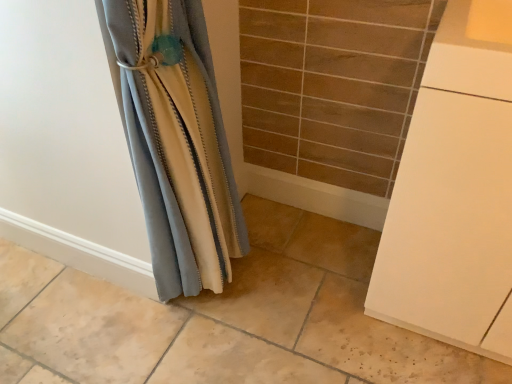
Question: Is white matte cabinet at right wider or thinner than satin fabric curtain at left?

Choices:
 (A) thin
 (B) wide

Answer: (B)

Question: Considering the positions of white matte cabinet at right and satin fabric curtain at left in the image, is white matte cabinet at right bigger or smaller than satin fabric curtain at left?

Choices:
 (A) big
 (B) small

Answer: (A)

Question: Which is correct: white matte cabinet at right is inside satin fabric curtain at left, or outside of it?

Choices:
 (A) inside
 (B) outside

Answer: (B)

Question: Relative to white matte cabinet at right, is satin fabric curtain at left in front or behind?

Choices:
 (A) front
 (B) behind

Answer: (B)

Question: Is satin fabric curtain at left taller or shorter than white matte cabinet at right?

Choices:
 (A) short
 (B) tall

Answer: (B)

Question: Based on their positions, is satin fabric curtain at left located to the left or right of white matte cabinet at right?

Choices:
 (A) right
 (B) left

Answer: (B)

Question: Is satin fabric curtain at left bigger or smaller than white matte cabinet at right?

Choices:
 (A) big
 (B) small

Answer: (B)